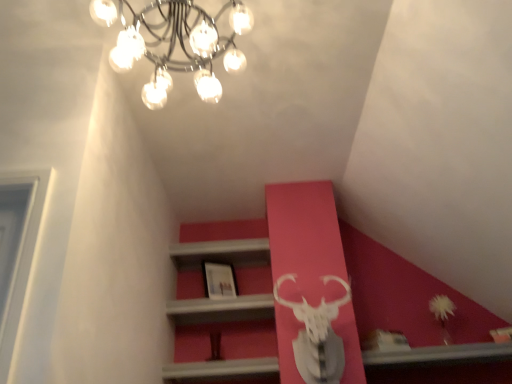
Question: Considering the relative positions of matte white picture frame at center and metallic chandelier at upper center in the image provided, is matte white picture frame at center to the right of metallic chandelier at upper center from the viewer's perspective?

Choices:
 (A) no
 (B) yes

Answer: (B)

Question: From a real-world perspective, is matte white picture frame at center physically below metallic chandelier at upper center?

Choices:
 (A) yes
 (B) no

Answer: (A)

Question: Is the depth of matte white picture frame at center greater than that of metallic chandelier at upper center?

Choices:
 (A) no
 (B) yes

Answer: (B)

Question: From the image's perspective, is matte white picture frame at center beneath metallic chandelier at upper center?

Choices:
 (A) no
 (B) yes

Answer: (B)

Question: Are matte white picture frame at center and metallic chandelier at upper center making contact?

Choices:
 (A) no
 (B) yes

Answer: (A)

Question: Does matte white picture frame at center have a larger size compared to metallic chandelier at upper center?

Choices:
 (A) yes
 (B) no

Answer: (B)

Question: Is the position of metallic chandelier at upper center more distant than that of matte white picture frame at center?

Choices:
 (A) yes
 (B) no

Answer: (B)

Question: From the image's perspective, does metallic chandelier at upper center appear lower than matte white picture frame at center?

Choices:
 (A) no
 (B) yes

Answer: (A)

Question: Can you confirm if metallic chandelier at upper center is shorter than matte white picture frame at center?

Choices:
 (A) yes
 (B) no

Answer: (B)

Question: Does metallic chandelier at upper center have a lesser width compared to matte white picture frame at center?

Choices:
 (A) no
 (B) yes

Answer: (A)

Question: Considering the relative sizes of metallic chandelier at upper center and matte white picture frame at center in the image provided, is metallic chandelier at upper center smaller than matte white picture frame at center?

Choices:
 (A) no
 (B) yes

Answer: (A)

Question: Is metallic chandelier at upper center beside matte white picture frame at center?

Choices:
 (A) no
 (B) yes

Answer: (A)

Question: In terms of height, does matte white picture frame at center look taller or shorter compared to metallic chandelier at upper center?

Choices:
 (A) tall
 (B) short

Answer: (B)